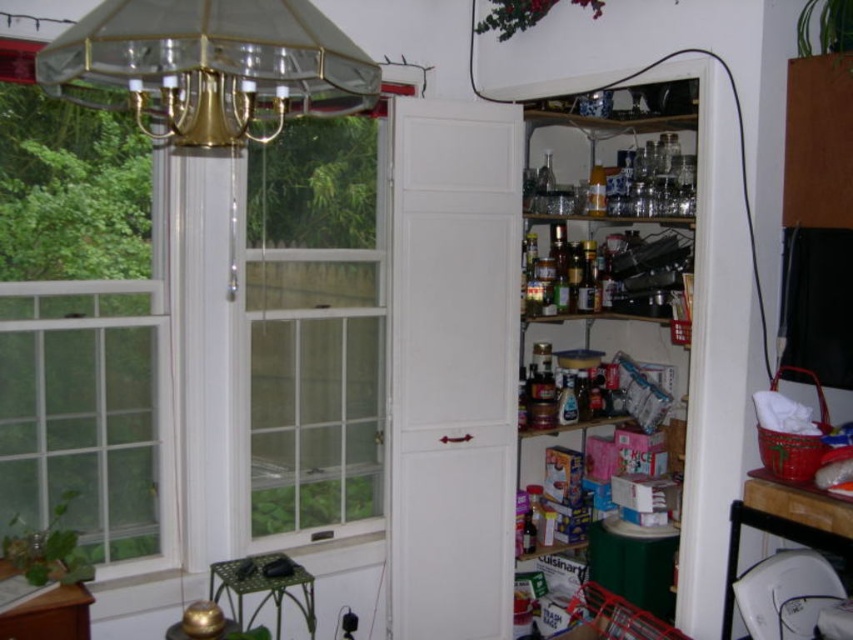
You are designing a sticker for the clear glass window at left and the clear glass window at center. If the sticker is 1 meter wide, will it fit on both windows?

The clear glass window at left is narrower than the clear glass window at center. Since the sticker is 1 meter wide, it might fit on the center window if its width is at least 1 meter, but it won

You are standing in the kitchen and see two points marked in the pantry storage area. Which point is closer to you, point (109, 465) or point (258, 380)?

Point (109, 465) is in front of point (258, 380), so it is closer to you.